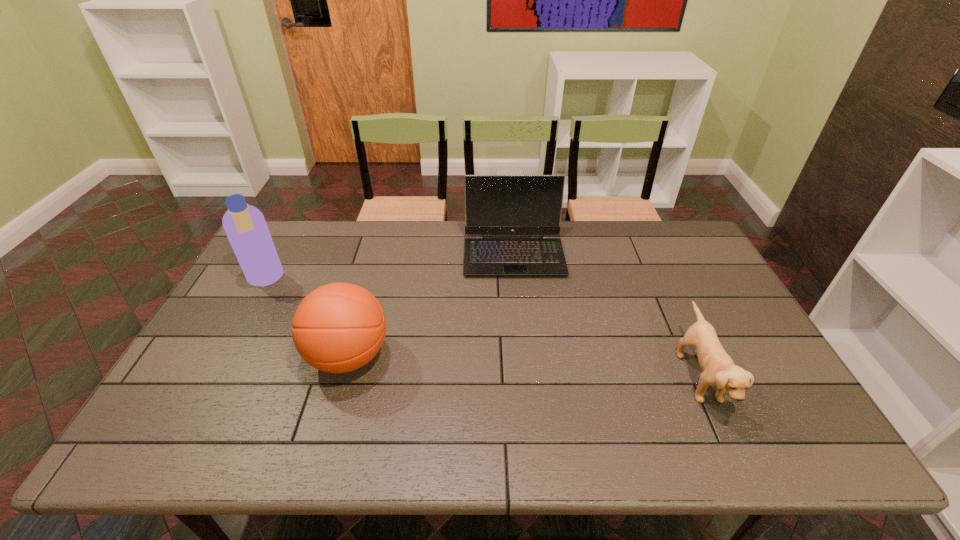
Locate an element on the screen. blank space that satisfies the following two spatial constraints: 1. on the front side of the basketball; 2. on the right side of the leftmost object is located at coordinates (223, 356).